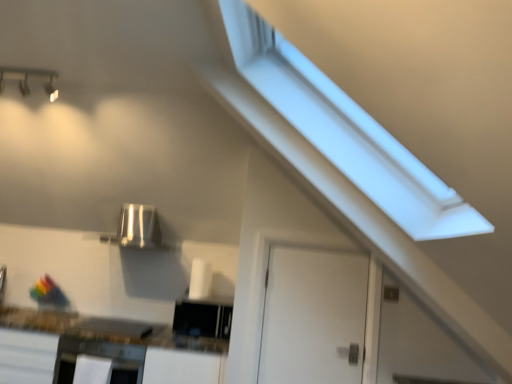
Question: Should I look upward or downward to see matte silver light fixture at upper left?

Choices:
 (A) down
 (B) up

Answer: (B)

Question: Can you confirm if satin black oven at lower left is thinner than white glossy countertop at lower left?

Choices:
 (A) no
 (B) yes

Answer: (B)

Question: Is satin black oven at lower left facing away from white glossy countertop at lower left?

Choices:
 (A) yes
 (B) no

Answer: (A)

Question: Is satin black oven at lower left in front of white glossy countertop at lower left?

Choices:
 (A) no
 (B) yes

Answer: (A)

Question: From the image's perspective, does satin black oven at lower left appear lower than white glossy countertop at lower left?

Choices:
 (A) no
 (B) yes

Answer: (A)

Question: From a real-world perspective, is satin black oven at lower left below white glossy countertop at lower left?

Choices:
 (A) no
 (B) yes

Answer: (A)

Question: Is white glossy countertop at lower left completely or partially inside satin black oven at lower left?

Choices:
 (A) yes
 (B) no

Answer: (B)

Question: Is matte silver light fixture at upper left completely or partially inside black glossy microwave at center, the 1th appliance positioned from the bottom?

Choices:
 (A) no
 (B) yes

Answer: (A)

Question: Is black glossy microwave at center, positioned as the first appliance in right-to-left order, further to the viewer compared to matte silver light fixture at upper left?

Choices:
 (A) yes
 (B) no

Answer: (A)

Question: From the image's perspective, is black glossy microwave at center, the 1th appliance positioned from the bottom, below matte silver light fixture at upper left?

Choices:
 (A) no
 (B) yes

Answer: (B)

Question: Does black glossy microwave at center, positioned as the first appliance in right-to-left order, touch matte silver light fixture at upper left?

Choices:
 (A) yes
 (B) no

Answer: (B)

Question: Is black glossy microwave at center, positioned as the first appliance in right-to-left order, located outside matte silver light fixture at upper left?

Choices:
 (A) yes
 (B) no

Answer: (A)

Question: From the image's perspective, would you say black glossy microwave at center, the 1th appliance positioned from the bottom, is positioned over matte silver light fixture at upper left?

Choices:
 (A) yes
 (B) no

Answer: (B)

Question: Is satin silver appliance at center, the 2th appliance in the right-to-left sequence, smaller than white matte door at center?

Choices:
 (A) yes
 (B) no

Answer: (B)